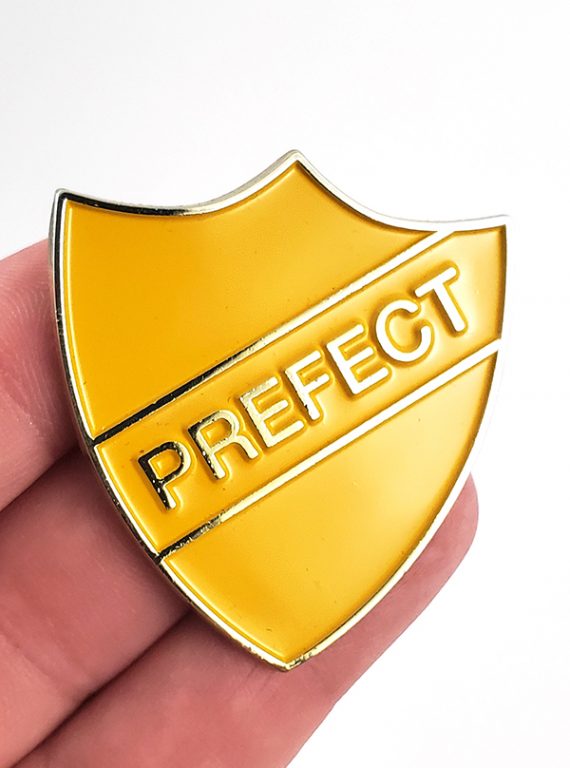
Locate an element on the screen. gold border is located at coordinates (180, 202).